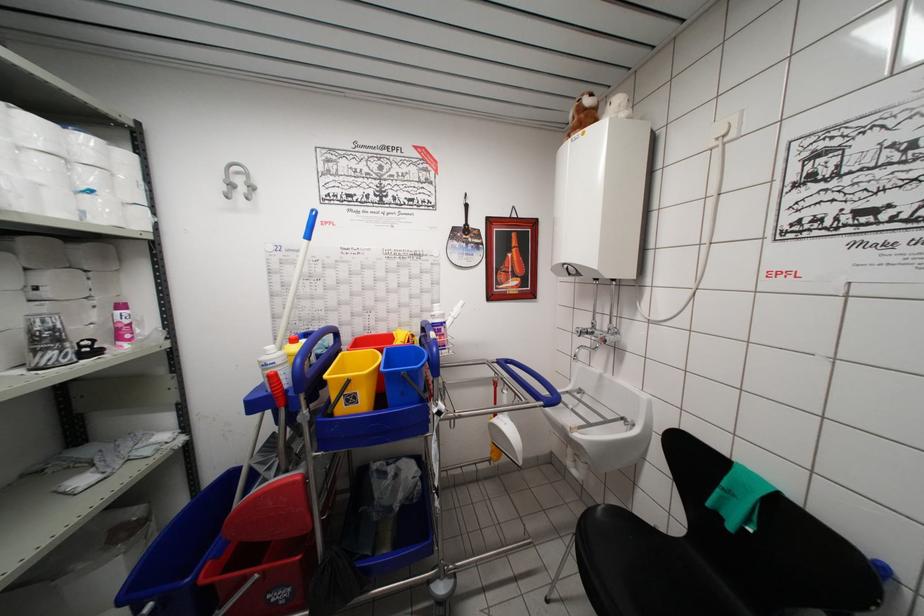
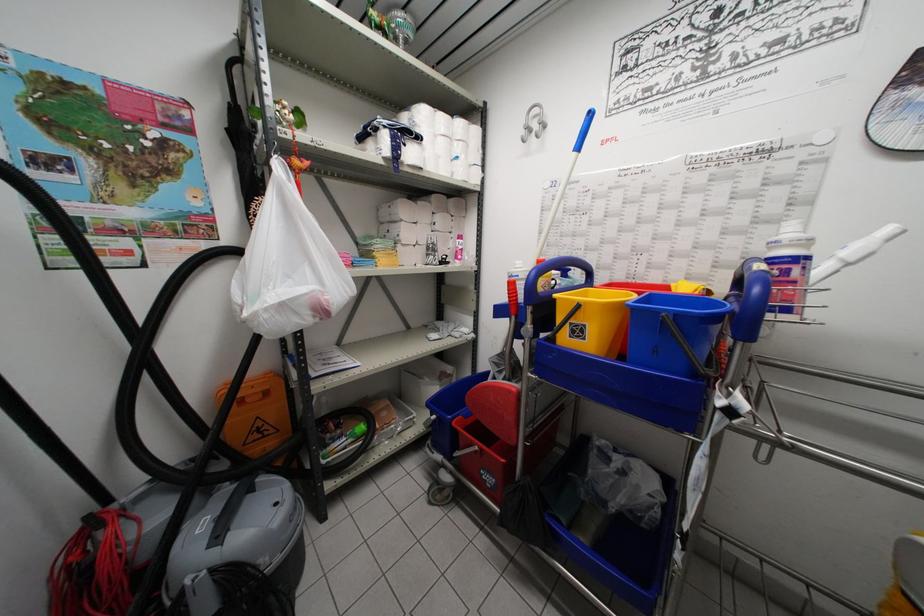
Question: The camera is either moving clockwise (left) or counter-clockwise (right) around the object. The first image is from the beginning of the video and the second image is from the end. Is the camera moving left or right when shooting the video?

Choices:
 (A) Left
 (B) Right

Answer: (B)